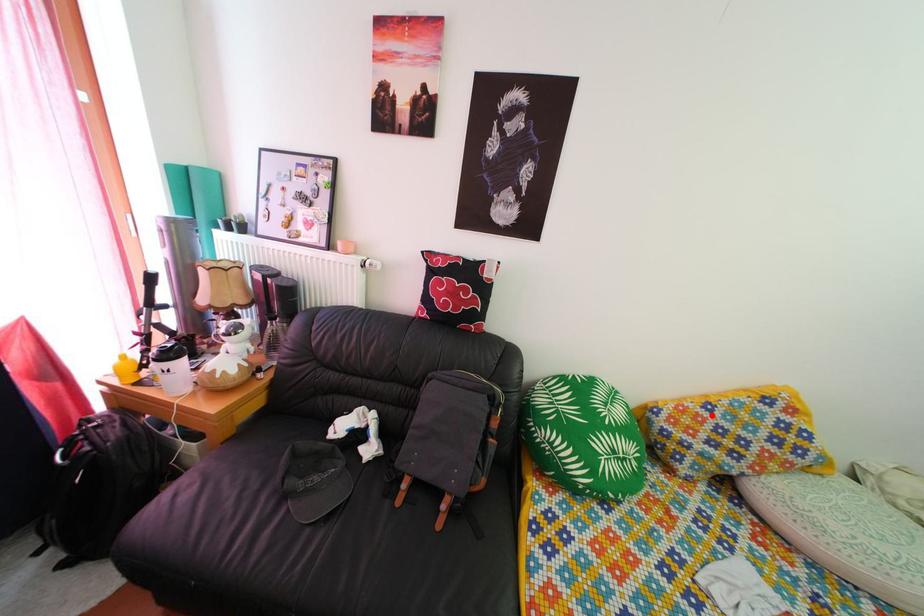
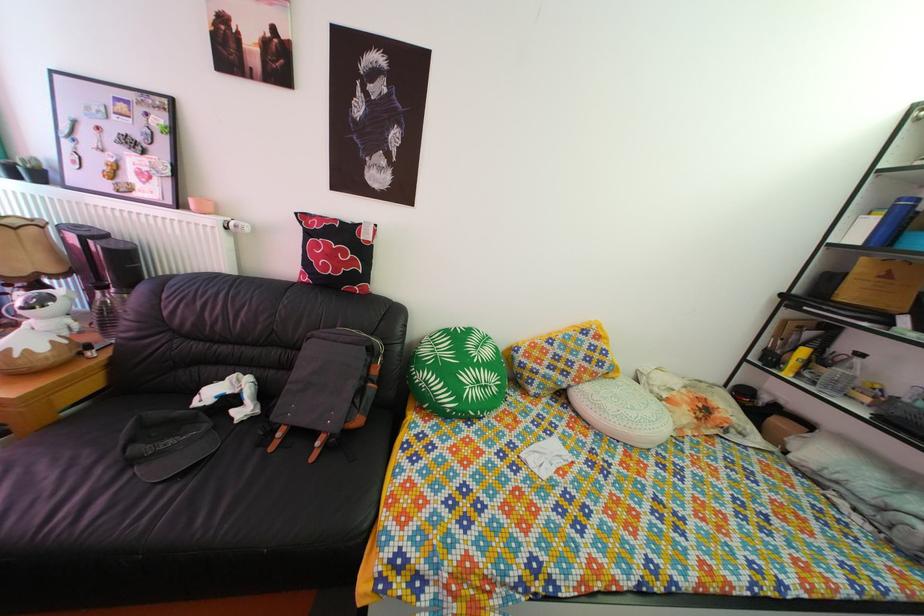
Where in the second image is the point corresponding to the highlighted location from the first image?

(555, 351)